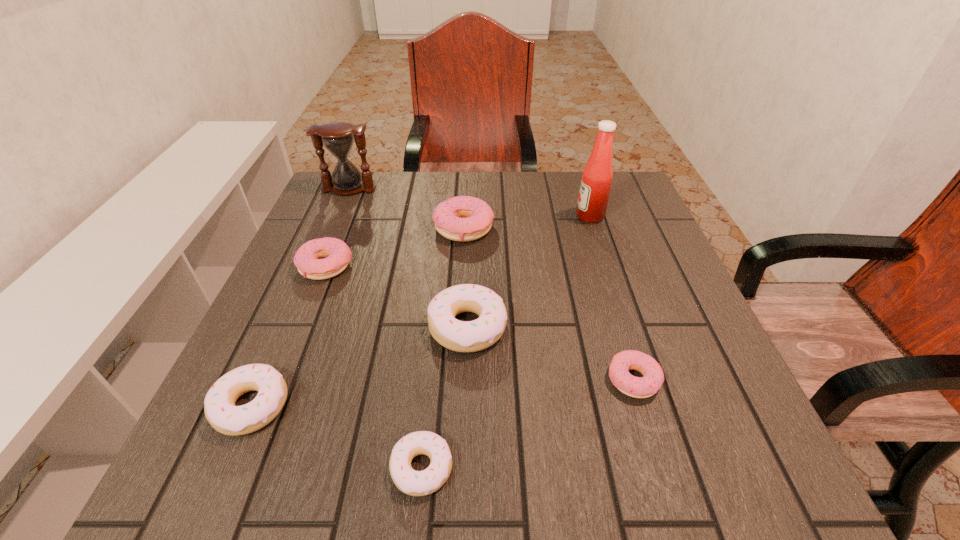
You are a GUI agent. You are given a task and a screenshot of the screen. Output one action in this format:
    pyautogui.click(x=<x>, y=<y>)
    Task: Click on the object that is positioned at the near left corner
    
    Given the screenshot: What is the action you would take?
    pyautogui.click(x=219, y=405)

You are a GUI agent. You are given a task and a screenshot of the screen. Output one action in this format:
    pyautogui.click(x=<x>, y=<y>)
    Task: Click on the object positioned at the far right corner
    
    Given the screenshot: What is the action you would take?
    pyautogui.click(x=597, y=176)

I want to click on vacant region at the far edge of the desktop, so click(387, 187).

The width and height of the screenshot is (960, 540). I want to click on vacant space at the left edge of the desktop, so click(250, 335).

Where is `free location at the right edge`? The height and width of the screenshot is (540, 960). free location at the right edge is located at coordinates (708, 366).

Locate an element on the screen. The width and height of the screenshot is (960, 540). vacant space at the far left corner is located at coordinates (379, 181).

I want to click on free space at the near right corner, so click(x=712, y=494).

The height and width of the screenshot is (540, 960). Find the location of `free spot between the condiment and the leftmost pink doughnut`. free spot between the condiment and the leftmost pink doughnut is located at coordinates (458, 241).

Locate an element on the screen. free space between the biggest pink doughnut and the red condiment is located at coordinates (526, 222).

Where is `unoccupied position between the smallest white doughnut and the leftmost pink doughnut`? The width and height of the screenshot is (960, 540). unoccupied position between the smallest white doughnut and the leftmost pink doughnut is located at coordinates (373, 367).